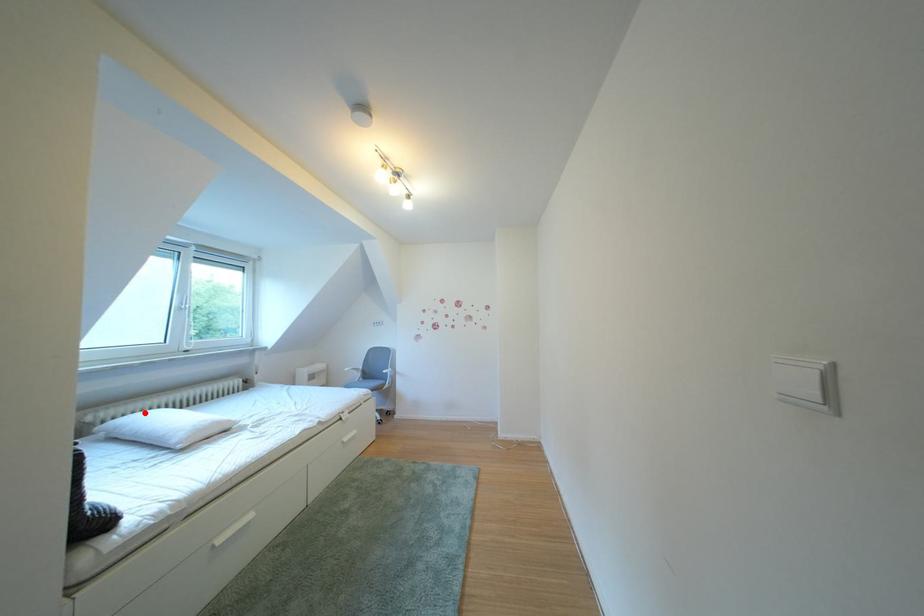
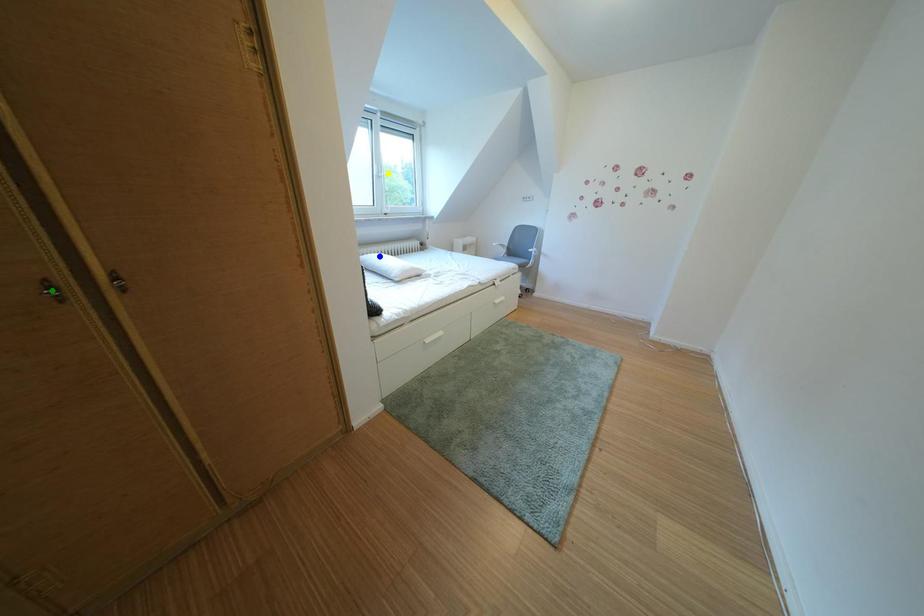
Question: I am providing you with two images of the same scene from different viewpoints. A red point is marked on the first image. You are given multiple points on the second image. Which point in image 2 represents the same 3d spot as the red point in image 1?

Choices:
 (A) yellow point
 (B) green point
 (C) blue point

Answer: (C)